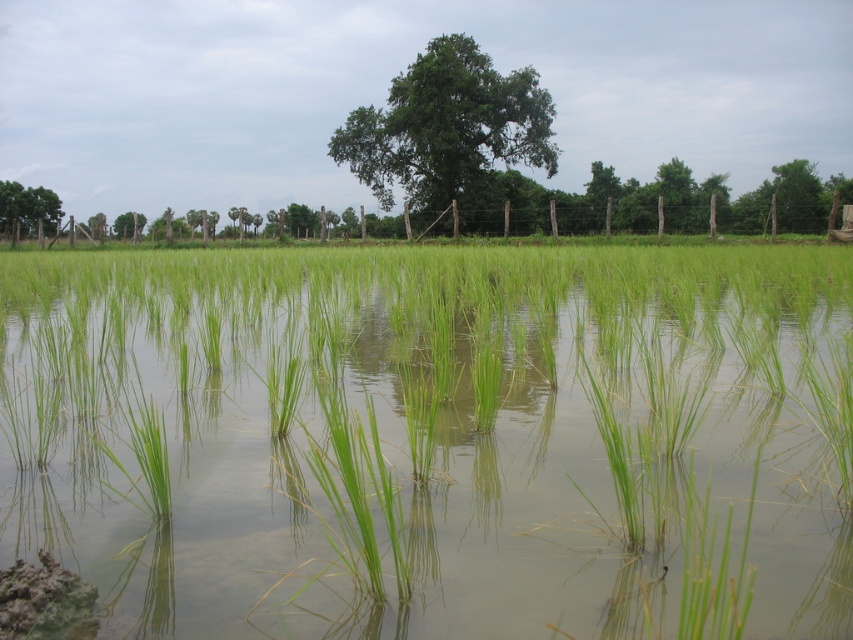
Question: Which object is farther from the camera taking this photo?

Choices:
 (A) green leafy tree at upper left
 (B) green leafy tree at center

Answer: (A)

Question: Which object appears closest to the camera in this image?

Choices:
 (A) green leafy tree at center
 (B) green grassy rice field at center
 (C) green leafy tree at upper left

Answer: (B)

Question: Is green grassy rice field at center below green leafy tree at upper left?

Choices:
 (A) no
 (B) yes

Answer: (B)

Question: Which object is farther from the camera taking this photo?

Choices:
 (A) green grassy rice field at center
 (B) green leafy tree at center

Answer: (B)

Question: Does green leafy tree at center appear under green leafy tree at upper left?

Choices:
 (A) yes
 (B) no

Answer: (B)

Question: Is the position of green grassy rice field at center less distant than that of green leafy tree at center?

Choices:
 (A) no
 (B) yes

Answer: (B)